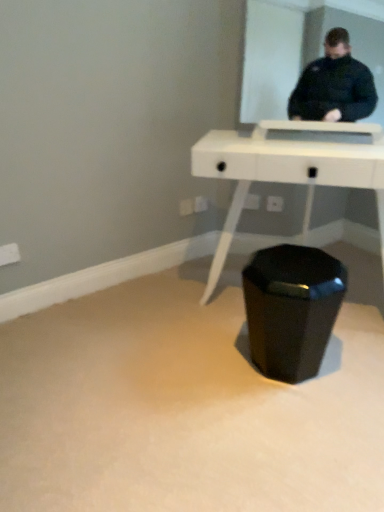
Question: Is black glossy waste container at center in front of or behind white glossy table at center in the image?

Choices:
 (A) behind
 (B) front

Answer: (A)

Question: Looking at the image, does black glossy waste container at center seem bigger or smaller compared to white glossy table at center?

Choices:
 (A) big
 (B) small

Answer: (B)

Question: From a real-world perspective, is black glossy waste container at center above or below white glossy table at center?

Choices:
 (A) below
 (B) above

Answer: (A)

Question: Which is correct: white glossy table at center is inside black glossy waste container at center, or outside of it?

Choices:
 (A) inside
 (B) outside

Answer: (B)

Question: From the image's perspective, is white glossy table at center above or below black glossy waste container at center?

Choices:
 (A) above
 (B) below

Answer: (A)

Question: Is point (233, 136) closer or farther from the camera than point (299, 324)?

Choices:
 (A) farther
 (B) closer

Answer: (A)

Question: Considering the positions of white glossy table at center and black glossy waste container at center in the image, is white glossy table at center bigger or smaller than black glossy waste container at center?

Choices:
 (A) small
 (B) big

Answer: (B)